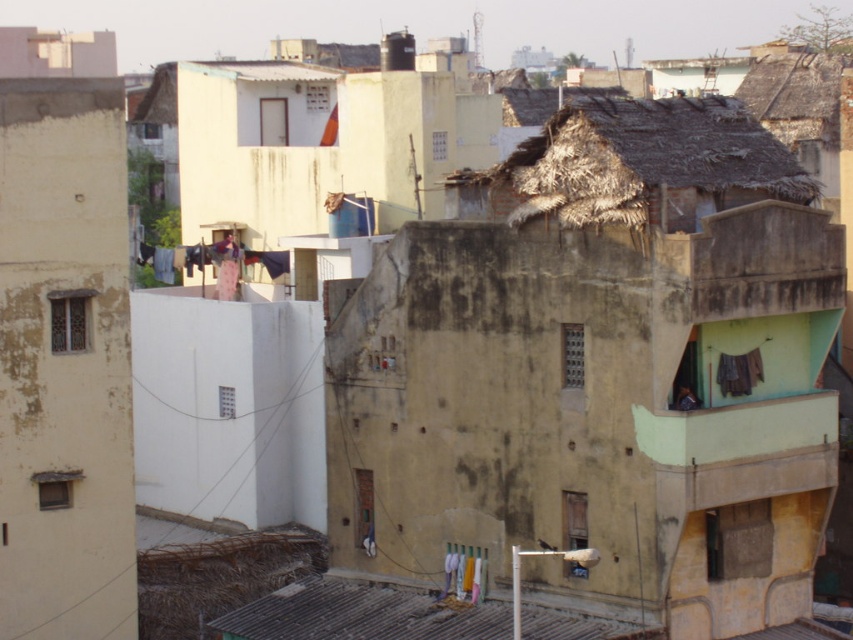
Which is more to the left, matte yellow wall at left or white fabric at center?

From the viewer's perspective, matte yellow wall at left appears more on the left side.

Is point (119, 305) positioned in front of point (483, 561)?

Yes.

This screenshot has height=640, width=853. Find the location of `matte yellow wall at left`. matte yellow wall at left is located at coordinates (64, 340).

Which is in front, point (32, 384) or point (625, 192)?

Point (625, 192) is more forward.

Which is behind, point (19, 554) or point (743, 168)?

Point (743, 168)

Where is `matte yellow wall at left`? matte yellow wall at left is located at coordinates (64, 340).

Looking at this image, is rusty corrugated metal roof at lower center further to the viewer compared to white fabric at center?

No, it is not.

Between rusty corrugated metal roof at lower center and white fabric at center, which one is positioned higher?

white fabric at center

Between point (375, 609) and point (462, 588), which one is positioned behind?

The point (375, 609) is behind.

This screenshot has width=853, height=640. I want to click on rusty corrugated metal roof at lower center, so click(x=363, y=612).